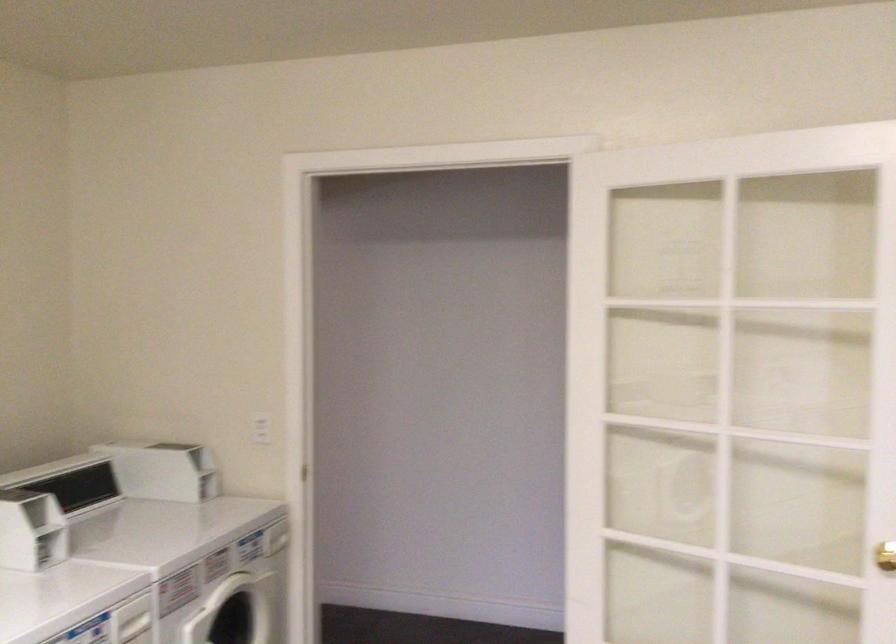
Locate an element on the screen. This screenshot has height=644, width=896. gold door knob is located at coordinates (885, 556).